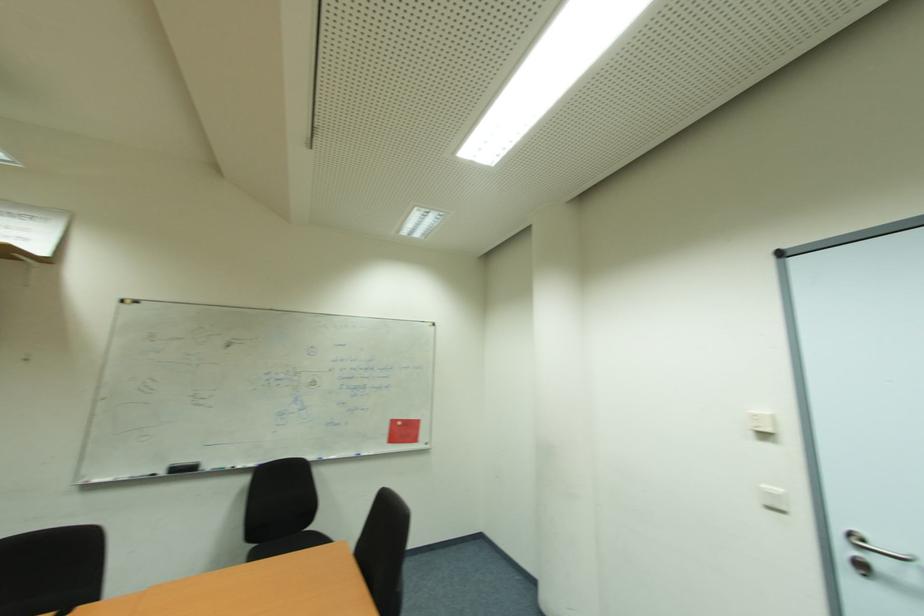
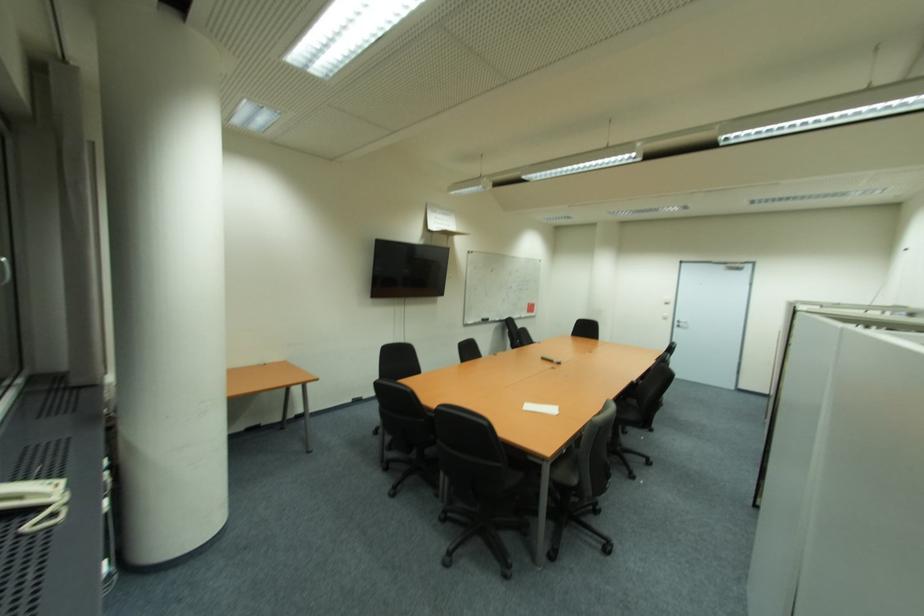
Locate, in the second image, the point that corresponds to [883,564] in the first image.

(686, 325)